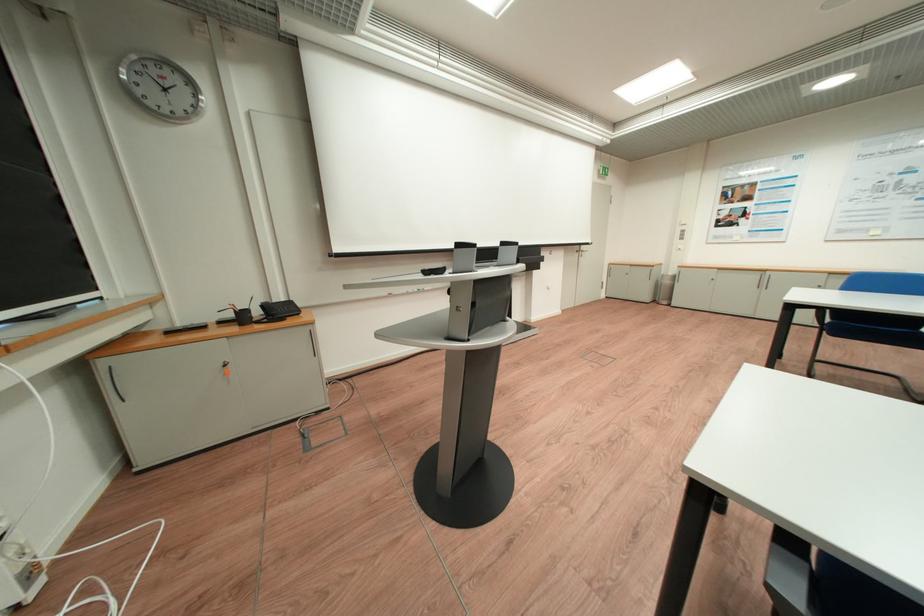
Find the location of a particular element. Image resolution: width=924 pixels, height=616 pixels. blue chair sitting surface is located at coordinates (877, 333).